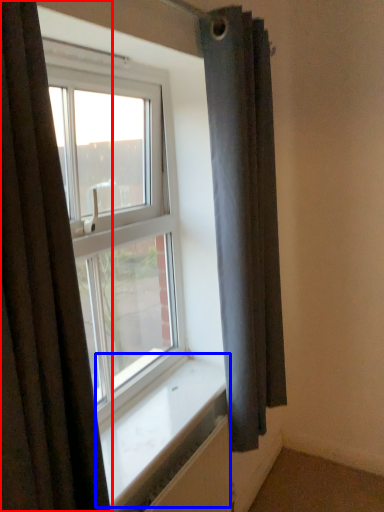
Question: Which of the following is the farthest to the observer, curtain (highlighted by a red box) or window sill (highlighted by a blue box)?

Choices:
 (A) curtain
 (B) window sill

Answer: (B)